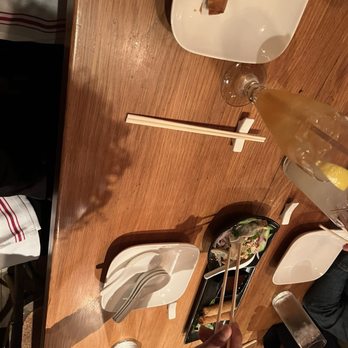
Locate an element on the screen. towel is located at coordinates point(4,211).